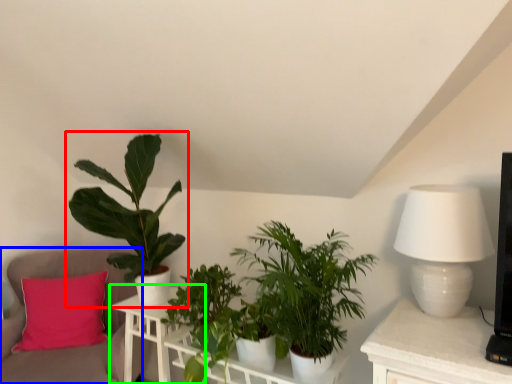
Question: Considering the real-world distances, which object is farthest from houseplant (highlighted by a red box)? swivel chair (highlighted by a blue box) or table (highlighted by a green box)?

Choices:
 (A) swivel chair
 (B) table

Answer: (A)